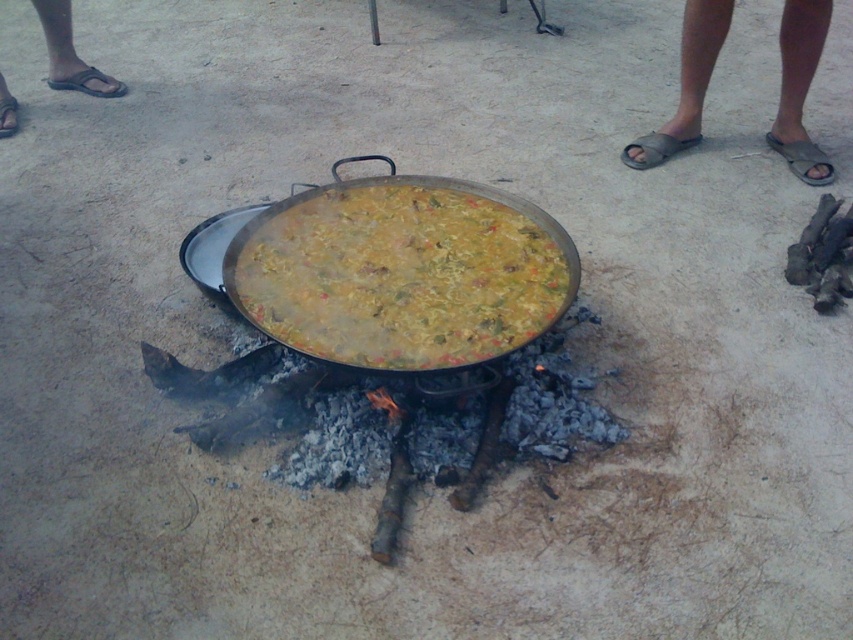
Question: Can you confirm if yellowish matte paella at center is positioned to the right of gray fabric sandals at right?

Choices:
 (A) no
 (B) yes

Answer: (A)

Question: Which point appears closest to the camera in this image?

Choices:
 (A) (466, 211)
 (B) (701, 22)

Answer: (A)

Question: Which of the following is the closest to the observer?

Choices:
 (A) (699, 61)
 (B) (453, 269)

Answer: (B)

Question: Does yellowish matte paella at center appear on the left side of gray fabric sandals at right?

Choices:
 (A) no
 (B) yes

Answer: (B)

Question: Is yellowish matte paella at center smaller than gray fabric sandals at right?

Choices:
 (A) no
 (B) yes

Answer: (B)